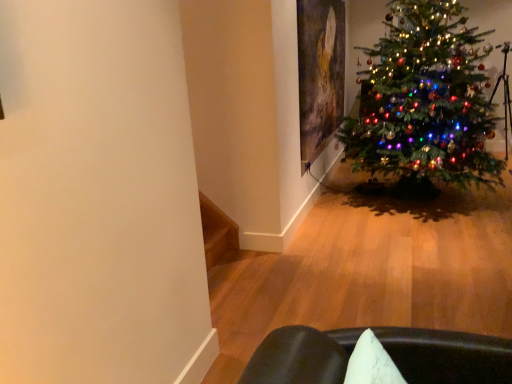
Question: Is oil painting at upper right directly adjacent to multicolored lights christmas tree at right?

Choices:
 (A) no
 (B) yes

Answer: (A)

Question: Is oil painting at upper right positioned with its back to multicolored lights christmas tree at right?

Choices:
 (A) no
 (B) yes

Answer: (B)

Question: From the image's perspective, is oil painting at upper right over multicolored lights christmas tree at right?

Choices:
 (A) yes
 (B) no

Answer: (A)

Question: Can you confirm if oil painting at upper right is smaller than multicolored lights christmas tree at right?

Choices:
 (A) yes
 (B) no

Answer: (A)

Question: Is oil painting at upper right to the left of multicolored lights christmas tree at right from the viewer's perspective?

Choices:
 (A) yes
 (B) no

Answer: (A)

Question: Is oil painting at upper right outside multicolored lights christmas tree at right?

Choices:
 (A) yes
 (B) no

Answer: (A)

Question: Is multicolored lights christmas tree at right directly adjacent to oil painting at upper right?

Choices:
 (A) yes
 (B) no

Answer: (B)

Question: Can you confirm if multicolored lights christmas tree at right is thinner than oil painting at upper right?

Choices:
 (A) no
 (B) yes

Answer: (A)

Question: Could you tell me if multicolored lights christmas tree at right is turned towards oil painting at upper right?

Choices:
 (A) no
 (B) yes

Answer: (B)

Question: Is multicolored lights christmas tree at right bigger than oil painting at upper right?

Choices:
 (A) no
 (B) yes

Answer: (B)

Question: Can you confirm if multicolored lights christmas tree at right is taller than oil painting at upper right?

Choices:
 (A) no
 (B) yes

Answer: (B)

Question: Considering the relative sizes of multicolored lights christmas tree at right and oil painting at upper right in the image provided, is multicolored lights christmas tree at right shorter than oil painting at upper right?

Choices:
 (A) yes
 (B) no

Answer: (B)

Question: Is oil painting at upper right in front of or behind multicolored lights christmas tree at right in the image?

Choices:
 (A) front
 (B) behind

Answer: (B)